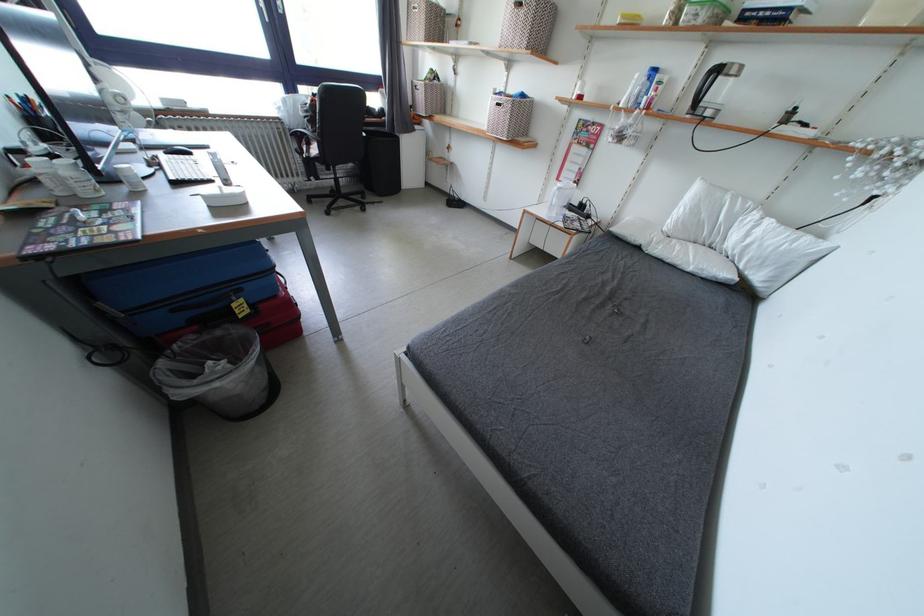
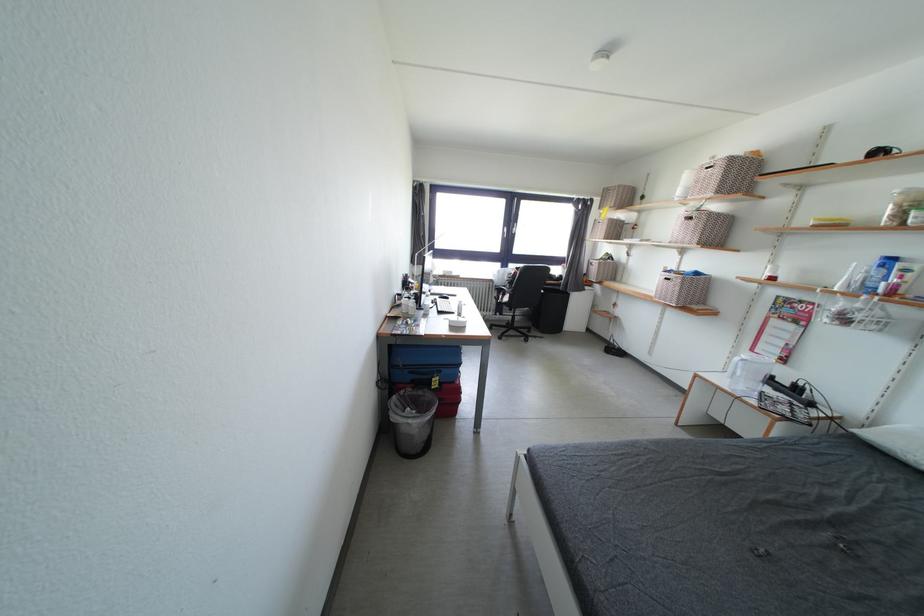
Locate, in the second image, the point that corresponds to pixel 240 310 in the first image.

(440, 384)